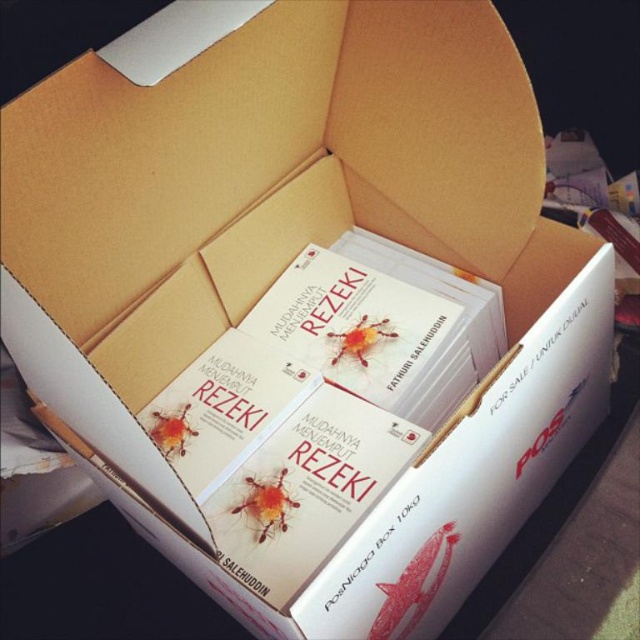
You are packing a box and notice two books inside. The first is the white matte book at center, and the second is the matte white book at center. Which book takes up more space in the box?

The white matte book at center takes up more space in the box because it is larger in size than the matte white book at center.

You are organizing a bookshelf and have two books in front of you. The first is a white matte book at center, and the second is a matte white book at center. Which book is taller?

The white matte book at center has a greater height compared to the matte white book at center.